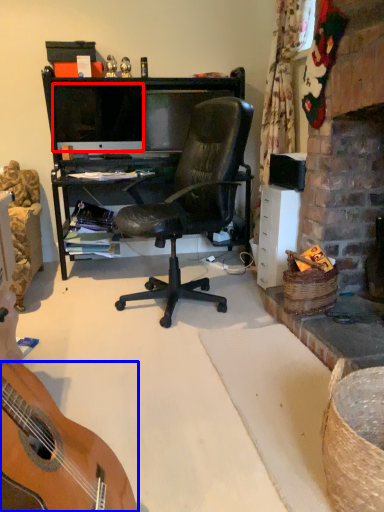
Question: Which of the following is the closest to the observer, television (highlighted by a red box) or guitar (highlighted by a blue box)?

Choices:
 (A) television
 (B) guitar

Answer: (B)